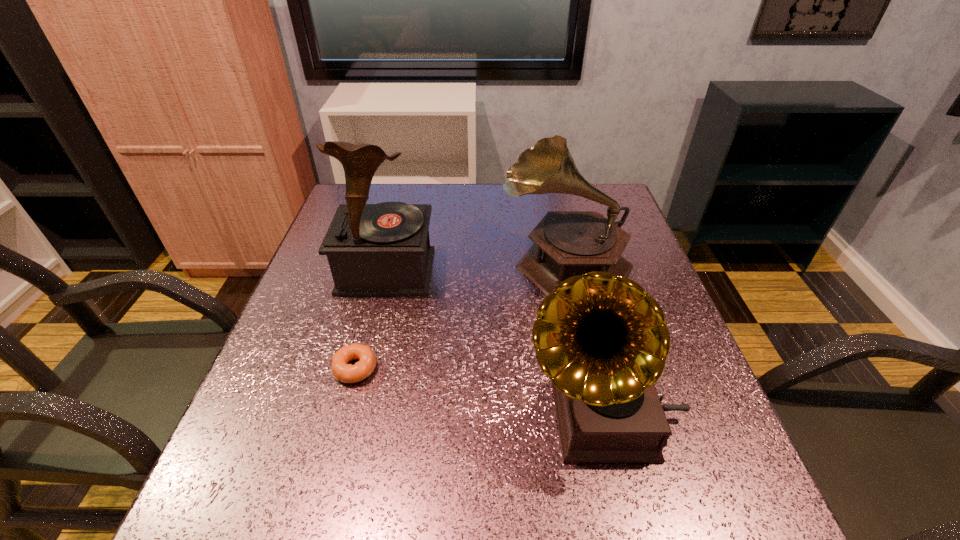
I want to click on the leftmost phonograph record, so click(383, 249).

Locate an element on the screen. The height and width of the screenshot is (540, 960). the nearest phonograph record is located at coordinates (602, 339).

Find the location of a particular element. The image size is (960, 540). doughnut is located at coordinates (341, 370).

Identify the location of vacant space situated 0.310m at the horn opening of the leftmost phonograph record. The image size is (960, 540). (350, 418).

Where is `blank space located 0.320m from the horn of the nearest phonograph record`? This screenshot has width=960, height=540. blank space located 0.320m from the horn of the nearest phonograph record is located at coordinates (342, 416).

Find the location of `vacant point located 0.090m from the horn of the nearest phonograph record`. vacant point located 0.090m from the horn of the nearest phonograph record is located at coordinates (471, 416).

You are a GUI agent. You are given a task and a screenshot of the screen. Output one action in this format:
    pyautogui.click(x=<x>, y=<y>)
    Task: Click on the vacant region located from the horn of the nearest phonograph record
    The width and height of the screenshot is (960, 540).
    Given the screenshot: What is the action you would take?
    pyautogui.click(x=455, y=416)

At what (x,y) coordinates should I click in order to perform the action: click on vacant point located on the right of the doughnut. Please return your answer as a coordinate pair (x, y). Looking at the image, I should click on (449, 369).

I want to click on object that is at the far edge, so click(x=566, y=243).

This screenshot has height=540, width=960. I want to click on phonograph_record present at the left edge, so click(383, 249).